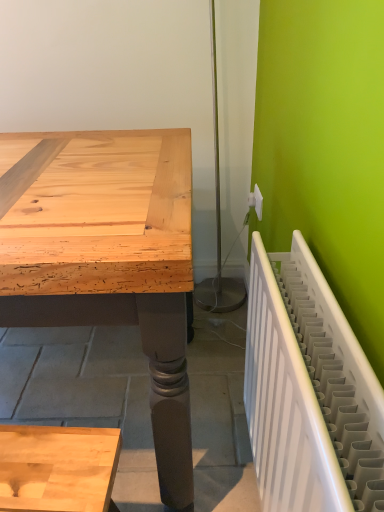
The width and height of the screenshot is (384, 512). What do you see at coordinates (309, 391) in the screenshot? I see `white plastic radiator at right` at bounding box center [309, 391].

At what (x,y) coordinates should I click in order to perform the action: click on white plastic radiator at right. Please return your answer as a coordinate pair (x, y). The width and height of the screenshot is (384, 512). Looking at the image, I should click on (309, 391).

Describe the element at coordinates (256, 201) in the screenshot. This screenshot has height=512, width=384. I see `white plastic electric outlet at upper right` at that location.

Locate an element on the screen. white plastic electric outlet at upper right is located at coordinates (x=256, y=201).

Consider the image. Measure the distance between white plastic electric outlet at upper right and camera.

4.92 feet.

What is the approximate height of white plastic electric outlet at upper right?

3.58 inches.

You are a GUI agent. You are given a task and a screenshot of the screen. Output one action in this format:
    pyautogui.click(x=<x>, y=<y>)
    Task: Click on the white plastic radiator at right
    
    Given the screenshot: What is the action you would take?
    pyautogui.click(x=309, y=391)

Is white plastic radiator at right at the left side of white plastic electric outlet at upper right?

Yes.

Does white plastic radiator at right lie behind white plastic electric outlet at upper right?

No, white plastic radiator at right is in front of white plastic electric outlet at upper right.

Does point (332, 323) come closer to viewer compared to point (259, 212)?

Yes.

From the image's perspective, is white plastic radiator at right positioned above or below white plastic electric outlet at upper right?

Based on their image positions, white plastic radiator at right is located beneath white plastic electric outlet at upper right.

From a real-world perspective, is white plastic radiator at right located higher than white plastic electric outlet at upper right?

No, from a real-world perspective, white plastic radiator at right is not on top of white plastic electric outlet at upper right.

Is white plastic radiator at right wider than white plastic electric outlet at upper right?

Yes.

Who is taller, white plastic radiator at right or white plastic electric outlet at upper right?

white plastic radiator at right is taller.

Is white plastic radiator at right bigger or smaller than white plastic electric outlet at upper right?

Clearly, white plastic radiator at right is larger in size than white plastic electric outlet at upper right.

Is white plastic radiator at right inside or outside of white plastic electric outlet at upper right?

white plastic radiator at right cannot be found inside white plastic electric outlet at upper right.

Is white plastic radiator at right far away from white plastic electric outlet at upper right?

No, white plastic radiator at right is in close proximity to white plastic electric outlet at upper right.

Is white plastic radiator at right facing towards white plastic electric outlet at upper right?

No, white plastic radiator at right is not facing towards white plastic electric outlet at upper right.

Find the location of a particular element. electric outlet on the right side of white plastic radiator at right is located at coordinates (256, 201).

Is white plastic electric outlet at upper right to the right of white plastic radiator at right from the viewer's perspective?

Indeed, white plastic electric outlet at upper right is positioned on the right side of white plastic radiator at right.

In the image, is white plastic electric outlet at upper right positioned in front of or behind white plastic radiator at right?

Clearly, white plastic electric outlet at upper right is behind white plastic radiator at right.

Is point (252, 194) closer to camera compared to point (318, 502)?

No, it is behind (318, 502).

From the image's perspective, which object appears higher, white plastic electric outlet at upper right or white plastic radiator at right?

white plastic electric outlet at upper right.

From a real-world perspective, between white plastic electric outlet at upper right and white plastic radiator at right, who is vertically higher?

white plastic electric outlet at upper right is physically above.

Which object is thinner, white plastic electric outlet at upper right or white plastic radiator at right?

white plastic electric outlet at upper right.

Considering the sizes of objects white plastic electric outlet at upper right and white plastic radiator at right in the image provided, who is shorter, white plastic electric outlet at upper right or white plastic radiator at right?

Standing shorter between the two is white plastic electric outlet at upper right.

Based on their sizes in the image, would you say white plastic electric outlet at upper right is bigger or smaller than white plastic radiator at right?

Clearly, white plastic electric outlet at upper right is smaller in size than white plastic radiator at right.

Can we say white plastic electric outlet at upper right lies outside white plastic radiator at right?

Yes, white plastic electric outlet at upper right is located beyond the bounds of white plastic radiator at right.

Is white plastic electric outlet at upper right next to white plastic radiator at right and touching it?

They are not placed beside each other.

Does white plastic electric outlet at upper right turn towards white plastic radiator at right?

No, white plastic electric outlet at upper right does not turn towards white plastic radiator at right.

Could you measure the distance between white plastic electric outlet at upper right and white plastic radiator at right?

white plastic electric outlet at upper right is 34.08 inches from white plastic radiator at right.

In order to click on electric outlet that is above the white plastic radiator at right (from a real-world perspective) in this screenshot , I will do `click(256, 201)`.

I want to click on radiator below the white plastic electric outlet at upper right (from the image's perspective), so click(309, 391).

Image resolution: width=384 pixels, height=512 pixels. I want to click on radiator on the left of white plastic electric outlet at upper right, so click(x=309, y=391).